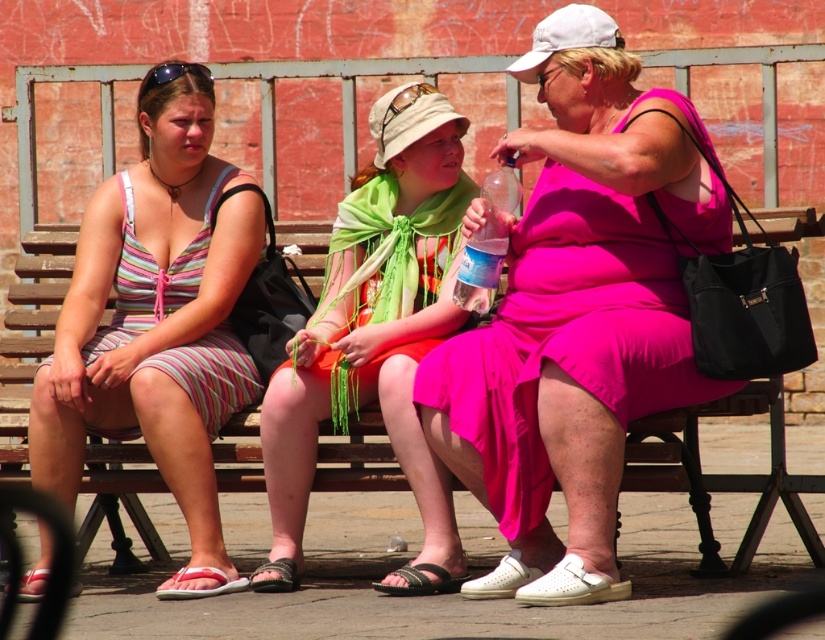
From the picture: Can you confirm if matte green scarf at center is positioned to the left of clear plastic bottle at center?

Yes, matte green scarf at center is to the left of clear plastic bottle at center.

Does matte green scarf at center have a greater width compared to clear plastic bottle at center?

No, matte green scarf at center is not wider than clear plastic bottle at center.

Between point (371, 349) and point (478, 296), which one is positioned in front?

Point (371, 349) is in front.

This screenshot has height=640, width=825. What are the coordinates of `matte green scarf at center` in the screenshot? It's located at (376, 339).

What do you see at coordinates (578, 314) in the screenshot? I see `pink matte dress at center` at bounding box center [578, 314].

The height and width of the screenshot is (640, 825). I want to click on pink matte dress at center, so click(578, 314).

Is pink matte dress at center bigger than matte brown goggles at center?

No, pink matte dress at center is not bigger than matte brown goggles at center.

Who is shorter, pink matte dress at center or matte brown goggles at center?

With less height is pink matte dress at center.

Is point (505, 525) behind point (401, 99)?

No, it is not.

The height and width of the screenshot is (640, 825). I want to click on pink matte dress at center, so click(578, 314).